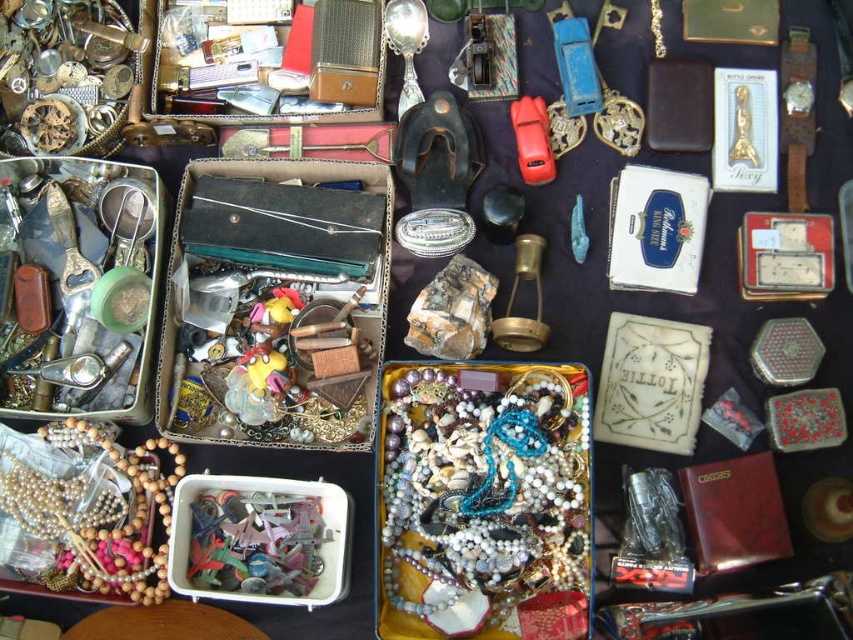
You are a customer at a flea market looking for a spoon to use with your coffee. You see the silver shiny spoon at upper center and the wooden beads at lower left. Which item is closer to the left edge of the display?

The wooden beads at lower left are closer to the left edge of the display because they are positioned to the left of the silver shiny spoon at upper center.

You are at a flea market and want to pick up the wooden beads at lower left and the silver shiny spoon at upper center. Which item will you need to move first to access the one behind it?

The wooden beads at lower left is in front of the silver shiny spoon at upper center, so you need to move the wooden beads at lower left first to access the silver shiny spoon at upper center.